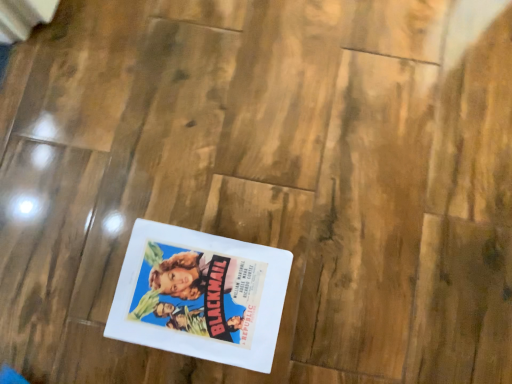
Measure the distance between white paper at center and camera.

A distance of 29.09 inches exists between white paper at center and camera.

The width and height of the screenshot is (512, 384). What are the coordinates of `white paper at center` in the screenshot? It's located at (200, 295).

The width and height of the screenshot is (512, 384). What do you see at coordinates (200, 295) in the screenshot?
I see `white paper at center` at bounding box center [200, 295].

Identify the location of white paper at center. The width and height of the screenshot is (512, 384). (200, 295).